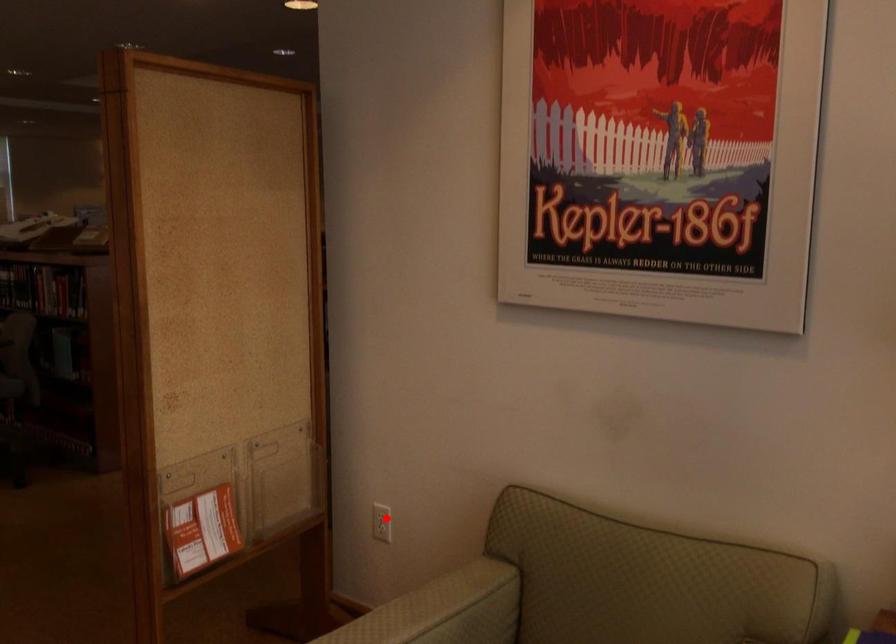
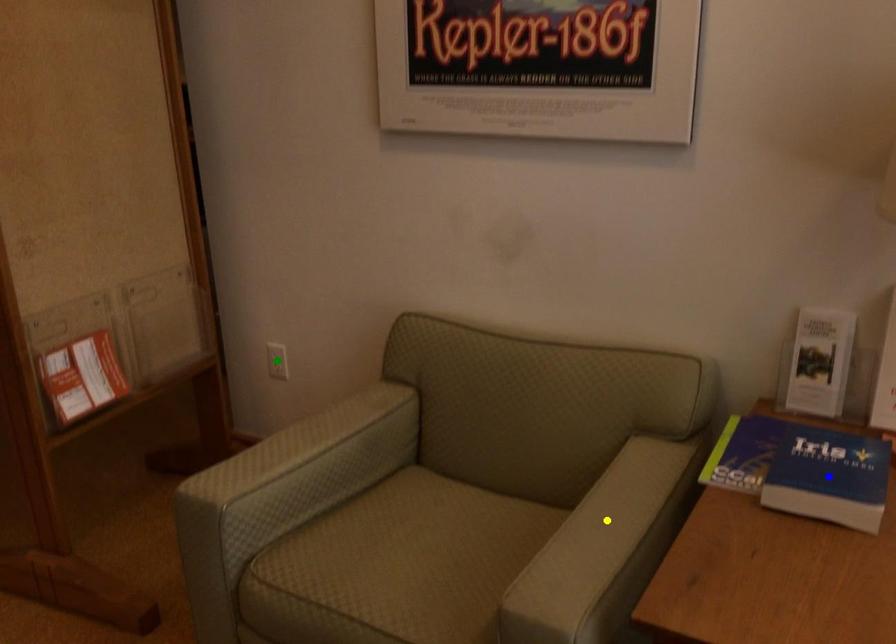
Question: I am providing you with two images of the same scene from different viewpoints. A red point is marked on the first image. You are given multiple points on the second image. Which spot in image 2 lines up with the point in image 1?

Choices:
 (A) blue point
 (B) yellow point
 (C) green point

Answer: (C)